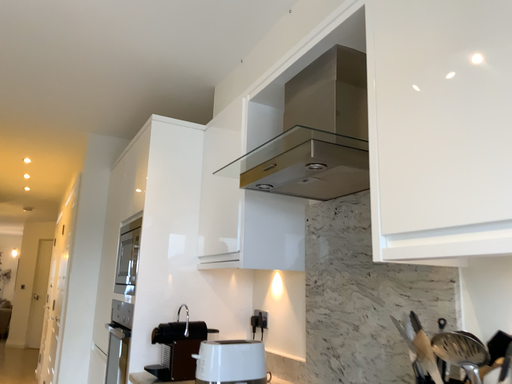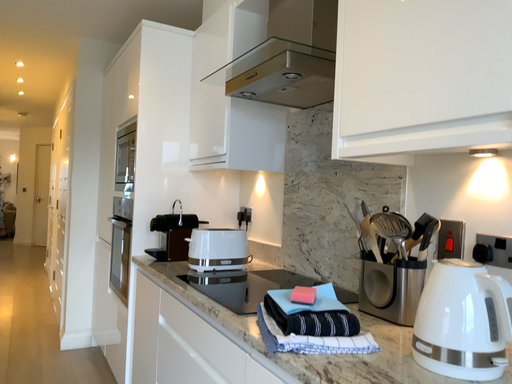
Question: How did the camera likely rotate when shooting the video?

Choices:
 (A) rotated upward
 (B) rotated downward

Answer: (B)